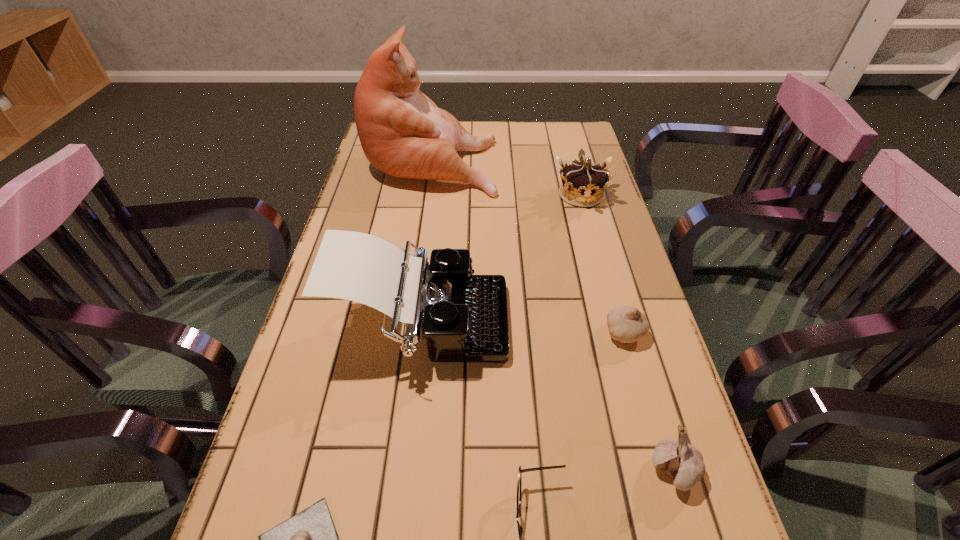
Locate an element on the screen. cat is located at coordinates (402, 132).

This screenshot has width=960, height=540. Find the location of `the second tallest object`. the second tallest object is located at coordinates (464, 318).

Find the location of a particular element. This screenshot has height=540, width=960. crown is located at coordinates (582, 184).

Locate an element on the screen. This screenshot has height=540, width=960. the tallest garlic is located at coordinates (683, 462).

This screenshot has height=540, width=960. Identify the location of the fourth tallest object. (683, 462).

Where is `the farthest garlic`? The height and width of the screenshot is (540, 960). the farthest garlic is located at coordinates (626, 324).

The width and height of the screenshot is (960, 540). I want to click on the second tallest garlic, so click(x=626, y=324).

Locate an element on the screen. The width and height of the screenshot is (960, 540). free spot located on the face of the tallest object is located at coordinates (519, 161).

Locate an element on the screen. The height and width of the screenshot is (540, 960). free space located 0.110m on the keys of the sixth shortest object is located at coordinates (555, 325).

Image resolution: width=960 pixels, height=540 pixels. What are the coordinates of `vacant space positioned 0.230m on the back of the fifth shortest object` in the screenshot? It's located at (566, 141).